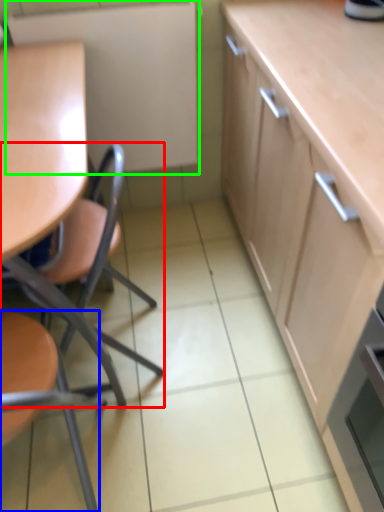
Question: Which object is positioned farthest from chair (highlighted by a red box)? Select from chair (highlighted by a blue box) and appliance (highlighted by a green box).

Choices:
 (A) chair
 (B) appliance

Answer: (B)